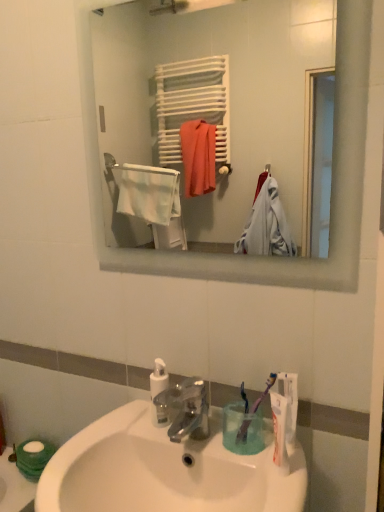
What are the coordinates of `vacant area to the right of satin nickel faucet at center` in the screenshot? It's located at [x=246, y=452].